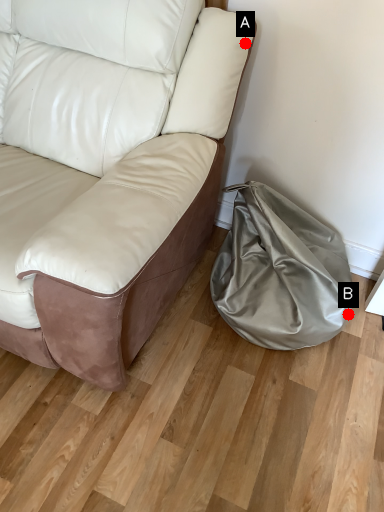
Question: Two points are circled on the image, labeled by A and B beside each circle. Which point is closer to the camera?

Choices:
 (A) A is closer
 (B) B is closer

Answer: (A)